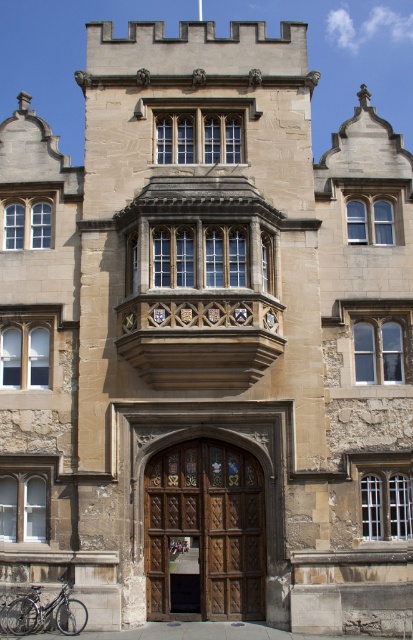
You are standing in front of the historic stone building and want to enter through the brown wooden door at center. There is a shiny metallic bicycle at lower left blocking your path. Can you walk around the bicycle to reach the door?

The brown wooden door at center is further to the viewer than the shiny metallic bicycle at lower left, meaning the bicycle is closer to you. Since the bicycle is closer, you can easily walk around it to access the door behind it.

Based on the photo, you are a delivery person trying to bring a large package through the entrance. The package is as wide as the shiny metallic bicycle at lower left. Can you fit the package through the brown wooden door at center?

The brown wooden door at center might be wider than shiny metallic bicycle at lower left, so the package should fit through the door if it matches the bicycle in width.